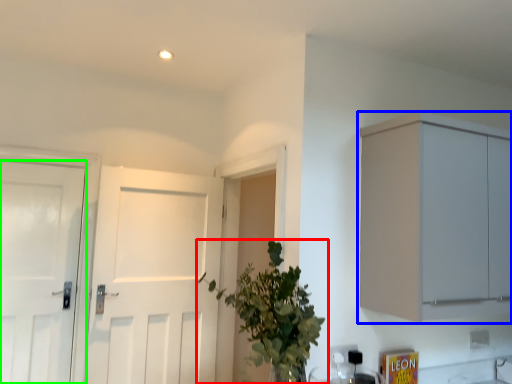
Question: Estimate the real-world distances between objects in this image. Which object is closer to houseplant (highlighted by a red box), cabinetry (highlighted by a blue box) or door (highlighted by a green box)?

Choices:
 (A) cabinetry
 (B) door

Answer: (A)